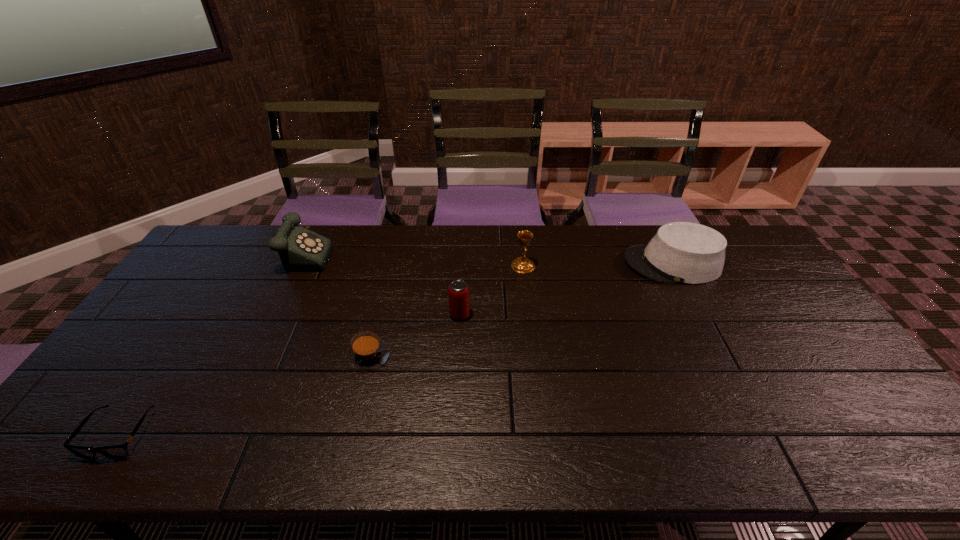
This screenshot has height=540, width=960. Find the location of `the second object from left to right`. the second object from left to right is located at coordinates click(300, 249).

Find the location of `chalice`. chalice is located at coordinates (521, 264).

Where is `beer can`? This screenshot has height=540, width=960. beer can is located at coordinates (458, 291).

At what (x,y) coordinates should I click in order to perform the action: click on the third nearest object. Please return your answer as a coordinate pair (x, y). The image size is (960, 540). Looking at the image, I should click on (458, 291).

Where is `hat`? This screenshot has height=540, width=960. hat is located at coordinates (680, 252).

Where is `the second nearest object`? This screenshot has height=540, width=960. the second nearest object is located at coordinates (367, 352).

Image resolution: width=960 pixels, height=540 pixels. I want to click on cappuccino, so click(x=367, y=352).

You are a GUI agent. You are given a task and a screenshot of the screen. Output one action in this format:
    pyautogui.click(x=<x>, y=<y>)
    Task: Click on the shortest object
    The height and width of the screenshot is (540, 960).
    Given the screenshot: What is the action you would take?
    pyautogui.click(x=118, y=451)

Find the location of `the leftmost object`. the leftmost object is located at coordinates (118, 451).

Image resolution: width=960 pixels, height=540 pixels. I want to click on free space located 0.090m on the dial of the telephone, so click(358, 251).